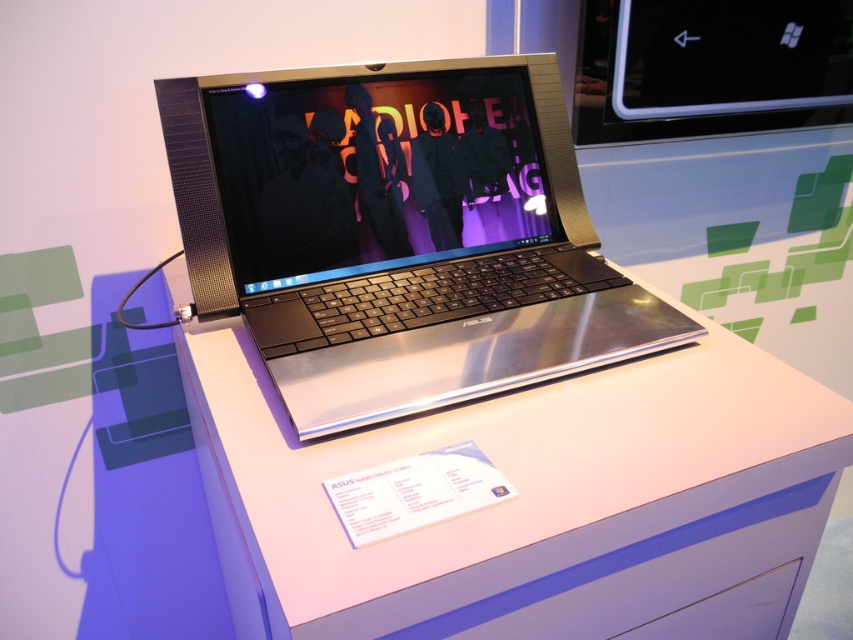
You are holding a smartphone that is 6 inches long and want to take a photo of the silver metallic table at center. If you place your phone horizontally on the floor directly facing the table, will the entire table fit in the frame without moving the phone?

The silver metallic table at center is 17.92 inches from the camera. Since the phone is placed 17.92 inches away, and the phone is 6 inches long, the entire table should fit in the frame as the distance is sufficient and the phone length is adequate for capturing the table at that distance.

You are taking a photo of the ASUS laptop and want to focus on the point at coordinates point (631, 563) and point (178, 88). Which point should you focus on first to ensure both are in focus?

You should focus on point (631, 563) first because it is closer to the camera than point (178, 88), so adjusting focus from closer to farther will help both points be in focus.

You are a delivery person who needs to place a 15 inch box between the silver metallic laptop at center and the matte purple drawer at lower center. Can the box fit in the space between them?

The silver metallic laptop at center and the matte purple drawer at lower center are 14.65 inches apart from each other. Since the box is 15 inches wide, it cannot fit in the space between them as the distance is slightly less than the box width.